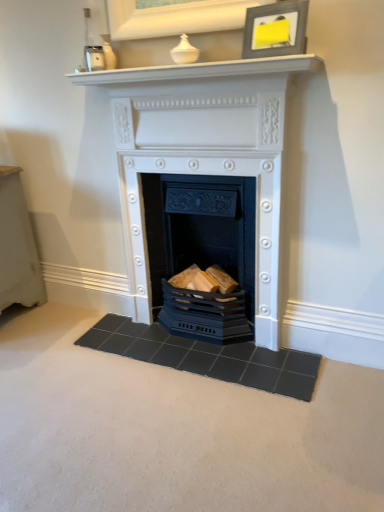
Question: Should I look upward or downward to see matte black picture frame at upper center?

Choices:
 (A) up
 (B) down

Answer: (A)

Question: Is white glossy mantle at upper center with matte black picture frame at upper center?

Choices:
 (A) yes
 (B) no

Answer: (B)

Question: Can you confirm if white glossy mantle at upper center is smaller than matte black picture frame at upper center?

Choices:
 (A) yes
 (B) no

Answer: (B)

Question: Is the depth of white glossy mantle at upper center greater than that of matte black picture frame at upper center?

Choices:
 (A) yes
 (B) no

Answer: (A)

Question: Is the depth of white glossy mantle at upper center less than that of matte black picture frame at upper center?

Choices:
 (A) no
 (B) yes

Answer: (A)

Question: Is white glossy mantle at upper center not within matte black picture frame at upper center?

Choices:
 (A) yes
 (B) no

Answer: (A)

Question: Can you confirm if white glossy mantle at upper center is shorter than matte black picture frame at upper center?

Choices:
 (A) no
 (B) yes

Answer: (B)

Question: Is dark gray tile doormat at center smaller than matte black fireplace at center, the 2th fireplace from the top?

Choices:
 (A) yes
 (B) no

Answer: (A)

Question: Is dark gray tile doormat at center at the right side of matte black fireplace at center, the 2th fireplace from the top?

Choices:
 (A) yes
 (B) no

Answer: (B)

Question: Is the depth of dark gray tile doormat at center less than that of matte black fireplace at center, placed as the 1th fireplace when sorted from bottom to top?

Choices:
 (A) no
 (B) yes

Answer: (B)

Question: Considering the relative sizes of dark gray tile doormat at center and matte black fireplace at center, the 2th fireplace from the top, in the image provided, is dark gray tile doormat at center bigger than matte black fireplace at center, the 2th fireplace from the top,?

Choices:
 (A) yes
 (B) no

Answer: (B)

Question: Is matte black fireplace at center, placed as the 1th fireplace when sorted from bottom to top, inside dark gray tile doormat at center?

Choices:
 (A) no
 (B) yes

Answer: (A)

Question: From a real-world perspective, is dark gray tile doormat at center on matte black fireplace at center, placed as the 1th fireplace when sorted from bottom to top?

Choices:
 (A) no
 (B) yes

Answer: (A)

Question: Is matte black picture frame at upper center facing towards dark gray tile doormat at center?

Choices:
 (A) yes
 (B) no

Answer: (B)